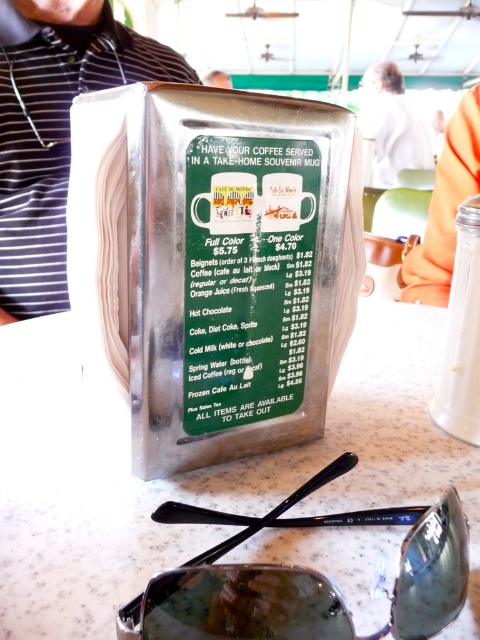
You are a customer at the diner and want to order a drink. You need to read the menu but also want to place your phone on the table. If your phone is 10 centimeters long, will there be enough space between the white marble table at center and the metallic green menu at center to place it without moving either item?

The distance between the white marble table at center and the metallic green menu at center is 14.48 centimeters. Since your phone is only 10 centimeters long, there is sufficient space to place it between them without moving either item.

You are a customer at the diner and want to point out two specific locations on the menu holder. The first location is at point (259, 604) and the second is at point (391, 84). Which of these two points is closer to you?

Point (259, 604) is closer to the viewer than point (391, 84).